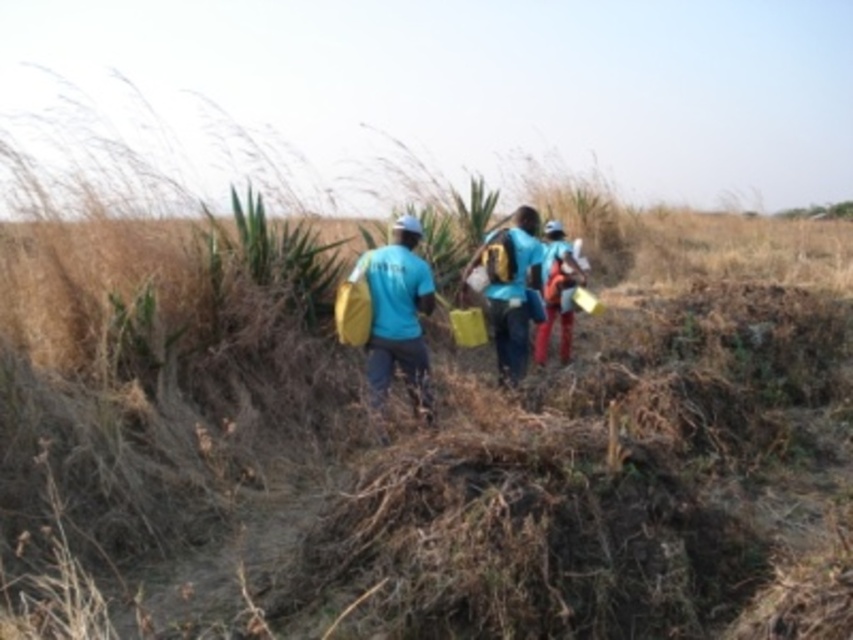
Between matte blue shirt at center and blue matte backpack at center, which one is positioned higher?

blue matte backpack at center is above.

Which is behind, point (426, 388) or point (519, 310)?

The point (519, 310) is more distant.

Image resolution: width=853 pixels, height=640 pixels. What do you see at coordinates (399, 316) in the screenshot?
I see `matte blue shirt at center` at bounding box center [399, 316].

At what (x,y) coordinates should I click in order to perform the action: click on matte blue shirt at center. Please return your answer as a coordinate pair (x, y). Image resolution: width=853 pixels, height=640 pixels. Looking at the image, I should click on (399, 316).

Between blue matte backpack at center and matte orange backpack at center, which one appears on the right side from the viewer's perspective?

From the viewer's perspective, matte orange backpack at center appears more on the right side.

Can you confirm if blue matte backpack at center is shorter than matte orange backpack at center?

Yes, blue matte backpack at center is shorter than matte orange backpack at center.

The height and width of the screenshot is (640, 853). Describe the element at coordinates (509, 288) in the screenshot. I see `blue matte backpack at center` at that location.

This screenshot has width=853, height=640. Find the location of `blue matte backpack at center`. blue matte backpack at center is located at coordinates (509, 288).

Does matte blue shirt at center have a lesser width compared to matte orange backpack at center?

In fact, matte blue shirt at center might be wider than matte orange backpack at center.

Which is in front, point (396, 296) or point (552, 220)?

Positioned in front is point (396, 296).

Identify the location of matte blue shirt at center. (399, 316).